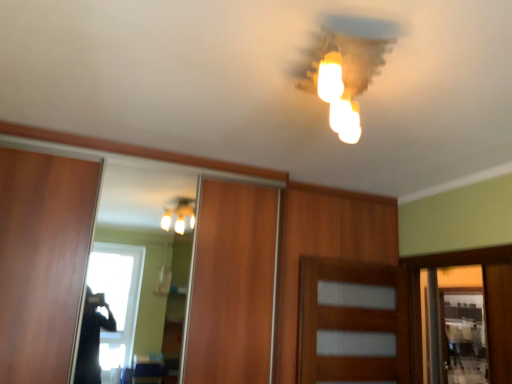
Question: Based on their sizes in the image, would you say wooden door at center is bigger or smaller than matte white light fixture at upper center?

Choices:
 (A) big
 (B) small

Answer: (A)

Question: Would you say wooden door at center is inside or outside matte white light fixture at upper center?

Choices:
 (A) inside
 (B) outside

Answer: (B)

Question: Considering the positions of point (303, 375) and point (344, 97), is point (303, 375) closer or farther from the camera than point (344, 97)?

Choices:
 (A) closer
 (B) farther

Answer: (B)

Question: From a real-world perspective, is matte white light fixture at upper center physically located above or below wooden door at center?

Choices:
 (A) below
 (B) above

Answer: (B)

Question: Looking at the image, does matte white light fixture at upper center seem bigger or smaller compared to wooden door at center?

Choices:
 (A) big
 (B) small

Answer: (B)

Question: In the image, is matte white light fixture at upper center on the left side or the right side of wooden door at center?

Choices:
 (A) right
 (B) left

Answer: (B)

Question: From the image's perspective, is matte white light fixture at upper center positioned above or below wooden door at center?

Choices:
 (A) below
 (B) above

Answer: (B)